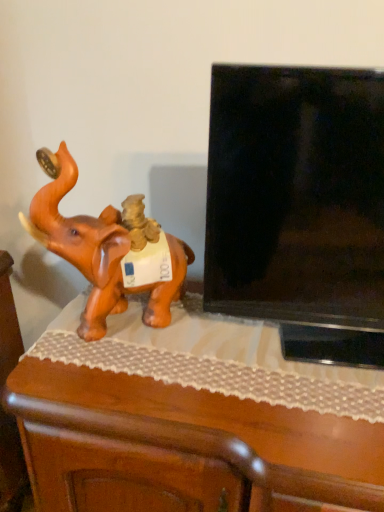
Question: From a real-world perspective, is black glossy tv at right above or below orange matte elephant at left?

Choices:
 (A) above
 (B) below

Answer: (A)

Question: In terms of height, does black glossy tv at right look taller or shorter compared to orange matte elephant at left?

Choices:
 (A) tall
 (B) short

Answer: (A)

Question: Estimate the real-world distances between objects in this image. Which object is farther from the orange matte elephant at left?

Choices:
 (A) black glossy tv at right
 (B) wooden table at left

Answer: (A)

Question: Considering the real-world distances, which object is farthest from the black glossy tv at right?

Choices:
 (A) orange matte elephant at left
 (B) wooden table at left

Answer: (A)